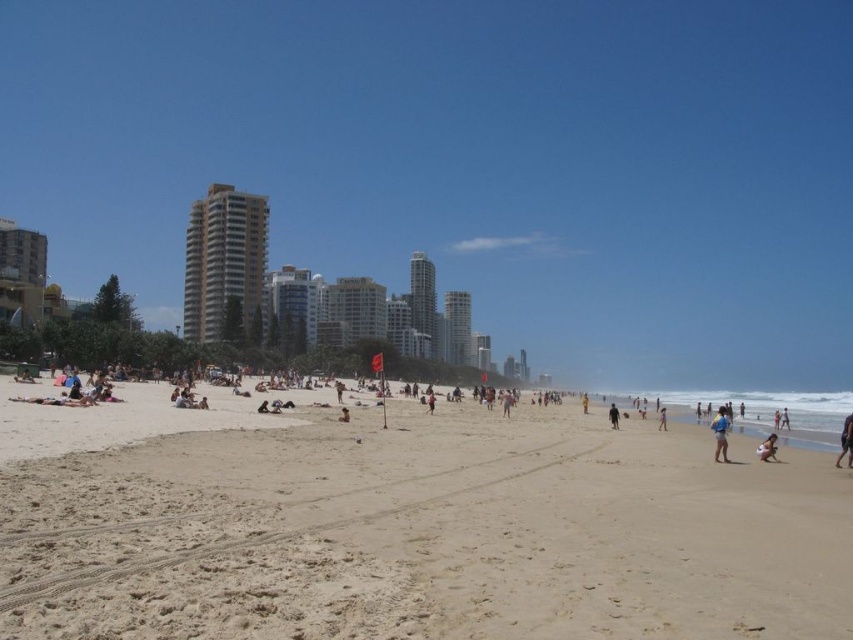
Question: Can you confirm if white cotton shirt at lower right is smaller than purple fabric at lower right?

Choices:
 (A) no
 (B) yes

Answer: (A)

Question: Which of the following is the closest to the observer?

Choices:
 (A) light brown sand at lower right
 (B) purple fabric at lower right

Answer: (B)

Question: Which point is closer to the camera?

Choices:
 (A) light brown sand at lower right
 (B) brown textured surfboard at center

Answer: (A)

Question: Is white cotton shirt at lower right wider than purple fabric at lower right?

Choices:
 (A) no
 (B) yes

Answer: (B)

Question: Does beige glass building at center appear over brown textured surfboard at center?

Choices:
 (A) yes
 (B) no

Answer: (A)

Question: Which point is closer to the camera?

Choices:
 (A) beige glass building at center
 (B) light brown sand at lower right

Answer: (B)